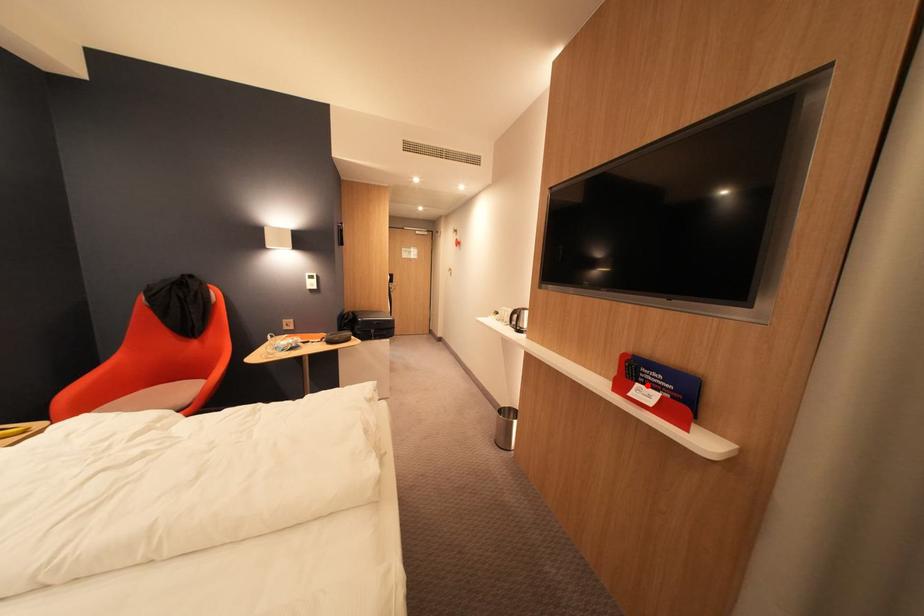
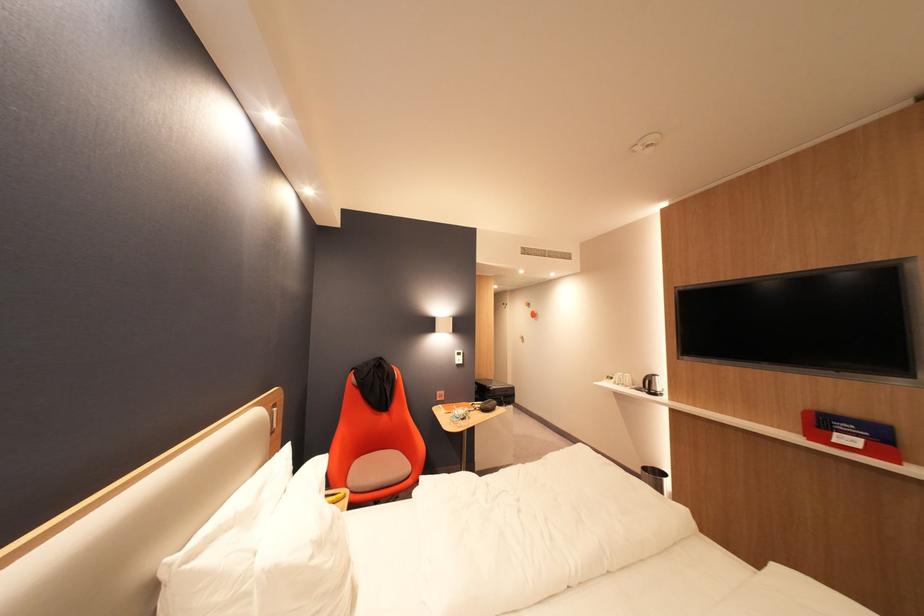
The point at the highlighted location is marked in the first image. Where is the corresponding point in the second image?

(846, 435)